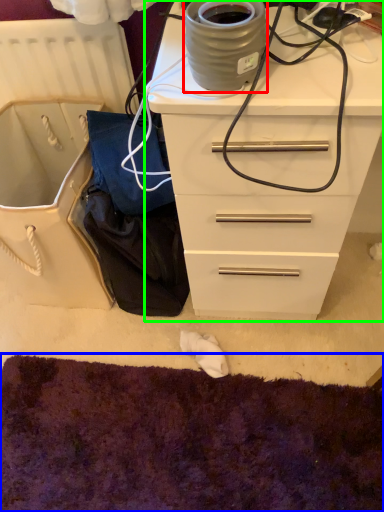
Question: Which is nearer to the appliance (highlighted by a red box)? cat bed (highlighted by a blue box) or chest of drawers (highlighted by a green box).

Choices:
 (A) cat bed
 (B) chest of drawers

Answer: (B)